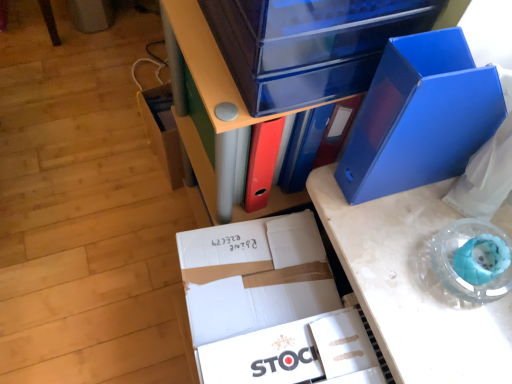
Question: Relative to matte plastic storage box at lower left, which appears as the 1th storage box when viewed from the back, is transparent plastic storage box at upper center, arranged as the second storage box when viewed from the left, in front or behind?

Choices:
 (A) front
 (B) behind

Answer: (A)

Question: From a real-world perspective, is transparent plastic storage box at upper center, which is the first storage box in front-to-back order, positioned above or below matte plastic storage box at lower left, which appears as the 1th storage box when viewed from the back?

Choices:
 (A) below
 (B) above

Answer: (B)

Question: Considering the real-world distances, which object is closest to the white cardboard box at center?

Choices:
 (A) white cardboard stock at center, which is counted as the 2th paperback book, starting from the top
 (B) transparent plastic storage box at upper center, arranged as the second storage box when viewed from the left
 (C) matte blue file at center
 (D) blue plastic folder at upper right, positioned as the 2th paperback book in left-to-right order
 (E) matte plastic storage box at lower left, which appears as the 1th storage box when viewed from the back

Answer: (A)

Question: Estimate the real-world distances between objects in this image. Which object is farther from the transparent plastic storage box at upper center, arranged as the second storage box when viewed from the left?

Choices:
 (A) blue plastic folder at upper right, the second paperback book ordered from the bottom
 (B) white cardboard box at center
 (C) matte blue file at center
 (D) blue plastic desk at center
 (E) white cardboard stock at center, which is counted as the 2th paperback book, starting from the top

Answer: (E)